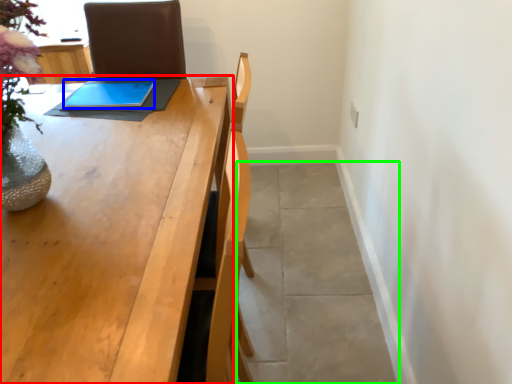
Question: Estimate the real-world distances between objects in this image. Which object is farther from table (highlighted by a red box), tablet computer (highlighted by a blue box) or concrete (highlighted by a green box)?

Choices:
 (A) tablet computer
 (B) concrete

Answer: (B)